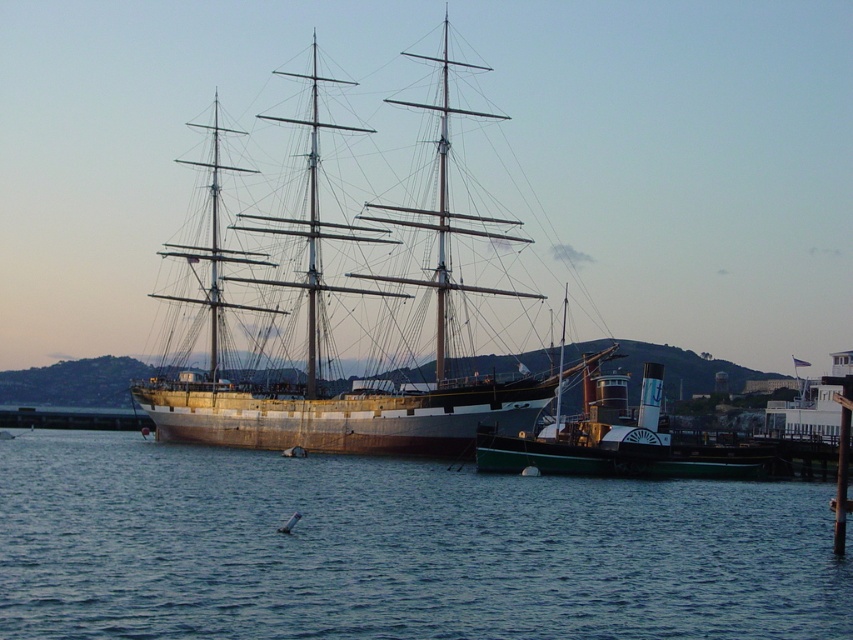
You are standing at the point with coordinates point (753, 602) and want to take a photo of the ship. The camera you are using has a maximum range of 60 meters. Will you be able to capture the ship clearly in your photo?

The distance between point (753, 602) and the camera is 65.78 meters, which exceeds the camera maximum range of 60 meters. Therefore, you will not be able to capture the ship clearly in your photo.